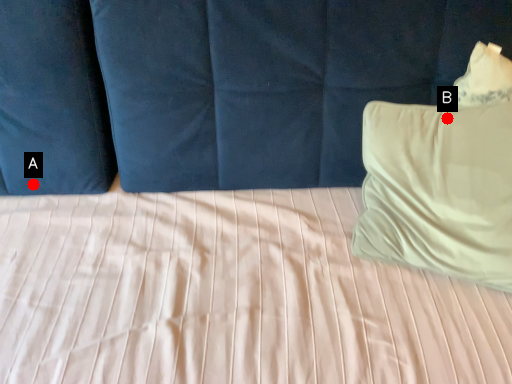
Question: Two points are circled on the image, labeled by A and B beside each circle. Which point is closer to the camera taking this photo?

Choices:
 (A) A is closer
 (B) B is closer

Answer: (B)